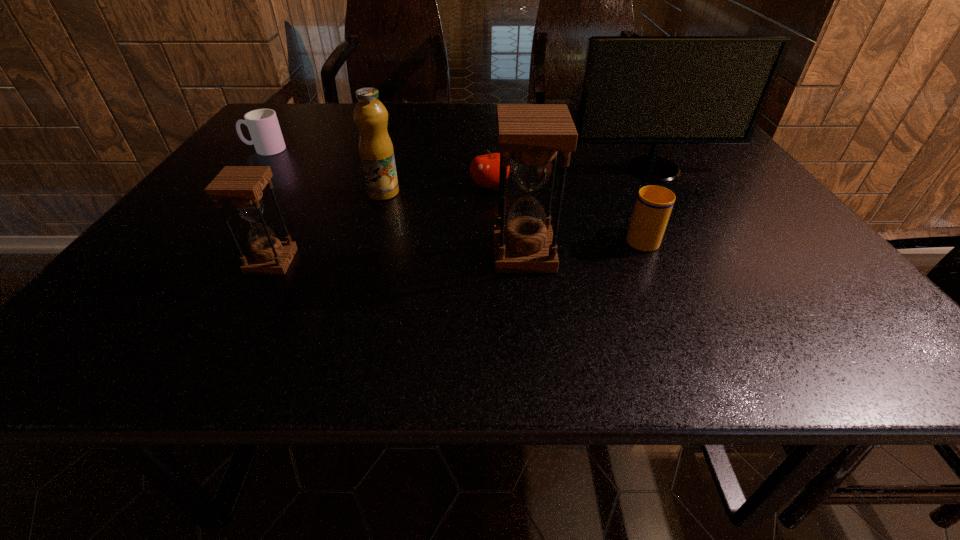
Please point a spot to add another hourglass on the right. Please provide its 2D coordinates. Your answer should be formatted as a tuple, i.e. [(x, y)], where the tuple contains the x and y coordinates of a point satisfying the conditions above.

[(766, 246)]